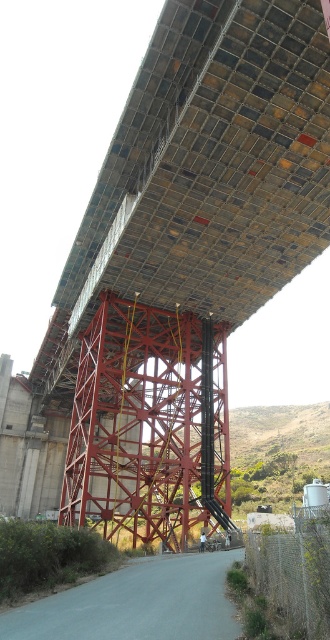
Question: Among these points, which one is nearest to the camera?

Choices:
 (A) (179, 195)
 (B) (226, 428)

Answer: (A)

Question: Does metallic grid at upper center lie in front of metallic red bridge at center?

Choices:
 (A) no
 (B) yes

Answer: (B)

Question: Can you confirm if metallic grid at upper center is positioned above metallic red bridge at center?

Choices:
 (A) yes
 (B) no

Answer: (A)

Question: Which point is closer to the camera?

Choices:
 (A) metallic grid at upper center
 (B) metallic red bridge at center

Answer: (A)

Question: Is metallic grid at upper center to the left of metallic red bridge at center from the viewer's perspective?

Choices:
 (A) yes
 (B) no

Answer: (A)

Question: Which point is closer to the camera taking this photo?

Choices:
 (A) (86, 422)
 (B) (224, 234)

Answer: (B)